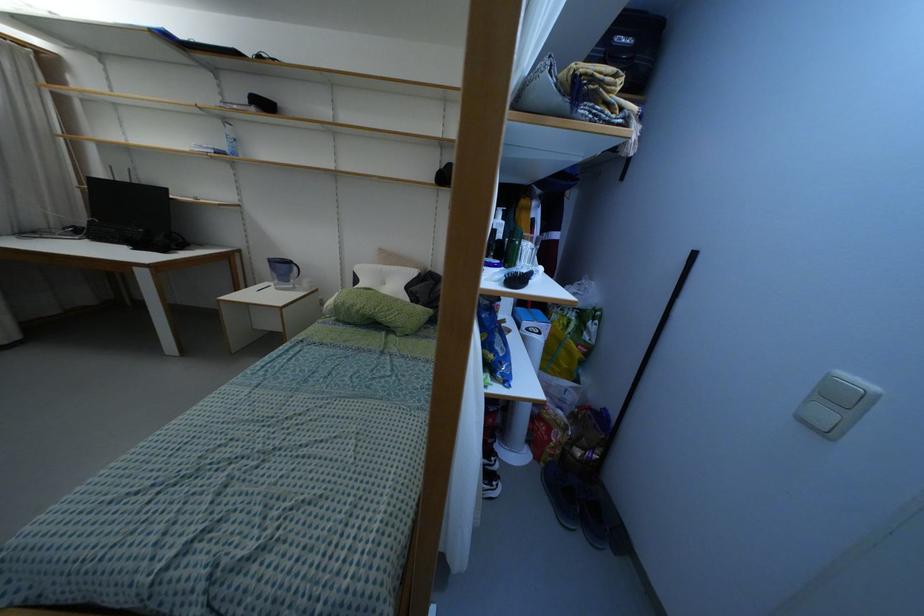
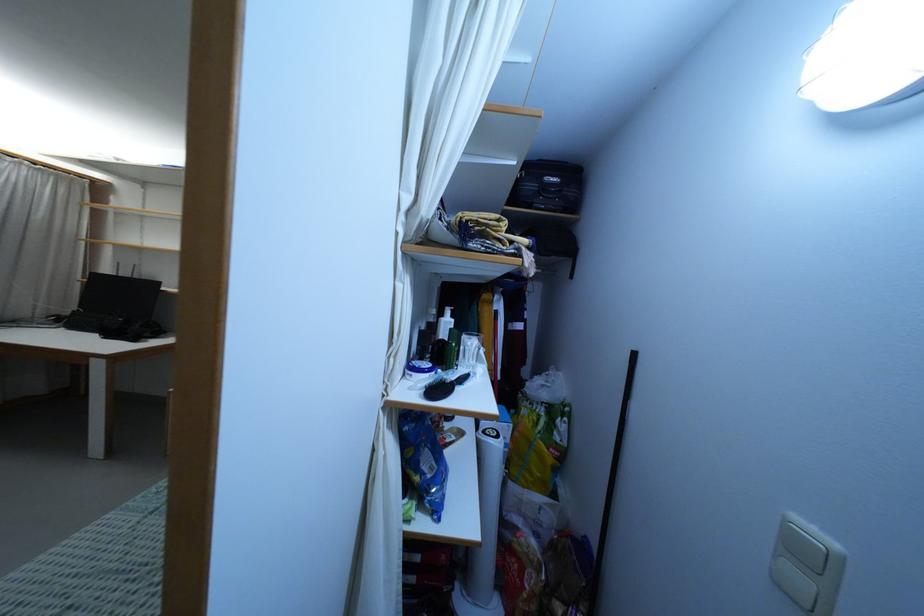
Where in the second image is the point corresponding to the point at 503,222 from the first image?

(453, 320)